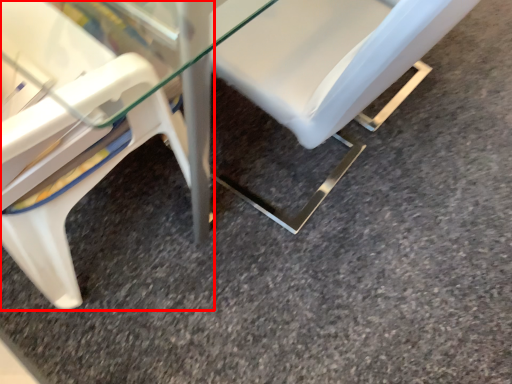
Question: Observing the image, what is the correct spatial positioning of chair (annotated by the red box) in reference to chair?

Choices:
 (A) left
 (B) right

Answer: (A)